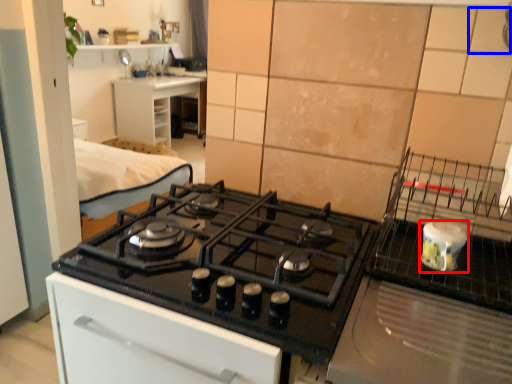
Question: Which point is further to the camera, kitchen appliance (highlighted by a red box) or tile (highlighted by a blue box)?

Choices:
 (A) kitchen appliance
 (B) tile

Answer: (A)